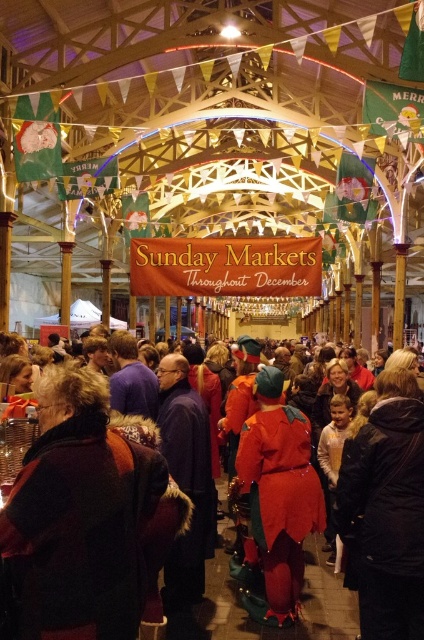
Which of these two, dark brown fur coat at center or shiny red costume at center, stands shorter?

dark brown fur coat at center

In the scene shown: Does dark brown fur coat at center have a smaller size compared to shiny red costume at center?

No.

Who is more forward, (123, 474) or (281, 461)?

Positioned in front is point (123, 474).

You are a GUI agent. You are given a task and a screenshot of the screen. Output one action in this format:
    pyautogui.click(x=<x>, y=<y>)
    Task: Click on the dark brown fur coat at center
    The width and height of the screenshot is (424, 640).
    Given the screenshot: What is the action you would take?
    pyautogui.click(x=86, y=515)